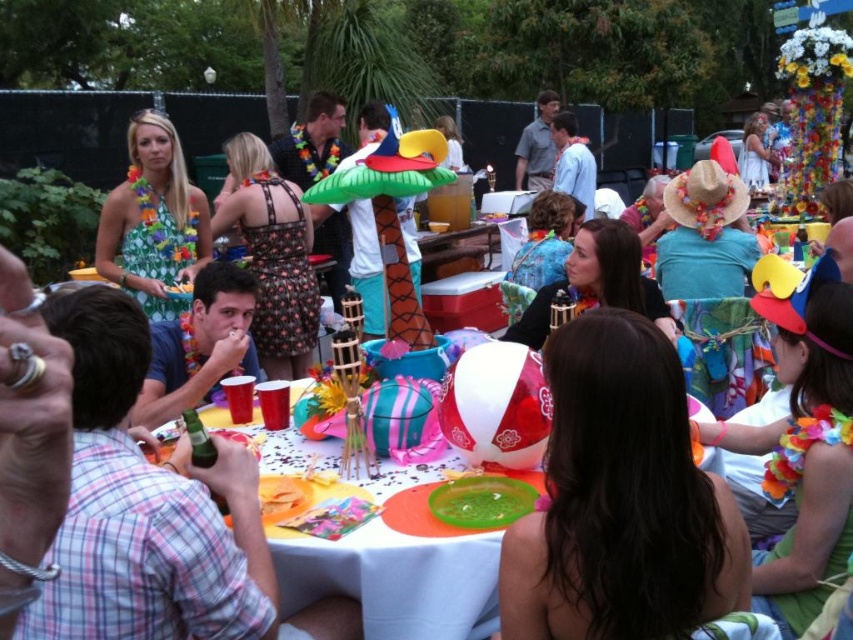
Does plastic disposable plates at center appear under green floral dress at left?

Indeed, plastic disposable plates at center is positioned under green floral dress at left.

Which is below, plastic disposable plates at center or green floral dress at left?

Positioned lower is plastic disposable plates at center.

Who is more forward, (386, 572) or (154, 154)?

Positioned in front is point (386, 572).

Find the location of a particular element. plastic disposable plates at center is located at coordinates (399, 563).

Does dark brown hair at center appear over plastic disposable plates at center?

Correct, dark brown hair at center is located above plastic disposable plates at center.

The image size is (853, 640). Describe the element at coordinates (619, 500) in the screenshot. I see `dark brown hair at center` at that location.

Identify the location of dark brown hair at center. (619, 500).

Who is shorter, dark brown hair at center or green floral dress at left?

With less height is dark brown hair at center.

Who is positioned more to the left, dark brown hair at center or green floral dress at left?

green floral dress at left

Find the location of a particular element. The image size is (853, 640). dark brown hair at center is located at coordinates (619, 500).

Where is `dark brown hair at center`? The height and width of the screenshot is (640, 853). dark brown hair at center is located at coordinates (619, 500).